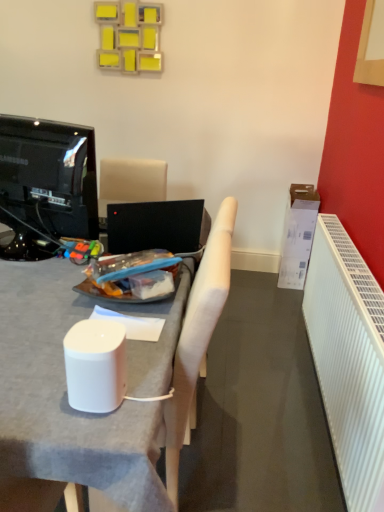
Question: From the image's perspective, would you say black glossy television at left is positioned over white ribbed radiator at right?

Choices:
 (A) no
 (B) yes

Answer: (B)

Question: Is black glossy television at left further to camera compared to white ribbed radiator at right?

Choices:
 (A) no
 (B) yes

Answer: (B)

Question: Considering the relative sizes of black glossy television at left and white ribbed radiator at right in the image provided, is black glossy television at left wider than white ribbed radiator at right?

Choices:
 (A) yes
 (B) no

Answer: (A)

Question: Is white ribbed radiator at right a part of black glossy television at left?

Choices:
 (A) yes
 (B) no

Answer: (B)

Question: Considering the relative sizes of black glossy television at left and white ribbed radiator at right in the image provided, is black glossy television at left shorter than white ribbed radiator at right?

Choices:
 (A) no
 (B) yes

Answer: (B)

Question: Considering the relative sizes of black glossy television at left and white ribbed radiator at right in the image provided, is black glossy television at left taller than white ribbed radiator at right?

Choices:
 (A) no
 (B) yes

Answer: (A)

Question: From the image's perspective, would you say white matte desk at center is shown under black glossy television at left?

Choices:
 (A) no
 (B) yes

Answer: (B)

Question: Can you confirm if white matte desk at center is smaller than black glossy television at left?

Choices:
 (A) yes
 (B) no

Answer: (B)

Question: Is black glossy television at left completely or partially inside white matte desk at center?

Choices:
 (A) no
 (B) yes

Answer: (A)

Question: Is white matte desk at center thinner than black glossy television at left?

Choices:
 (A) yes
 (B) no

Answer: (B)

Question: From a real-world perspective, does white matte desk at center sit lower than black glossy television at left?

Choices:
 (A) no
 (B) yes

Answer: (B)

Question: Does white matte desk at center lie behind black glossy television at left?

Choices:
 (A) no
 (B) yes

Answer: (A)

Question: Is white cardboard box at right looking in the opposite direction of white fabric chair at center?

Choices:
 (A) yes
 (B) no

Answer: (B)